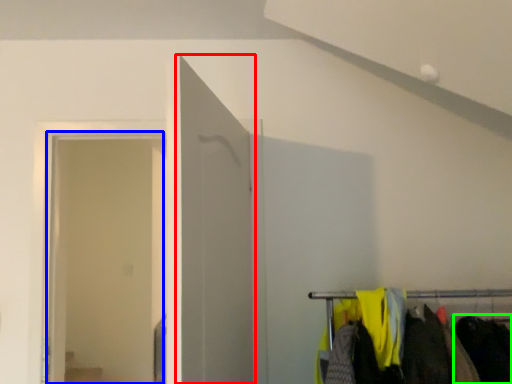
Question: Which is farther away from door (highlighted by a red box)? glass door (highlighted by a blue box) or clothing (highlighted by a green box)?

Choices:
 (A) glass door
 (B) clothing

Answer: (A)